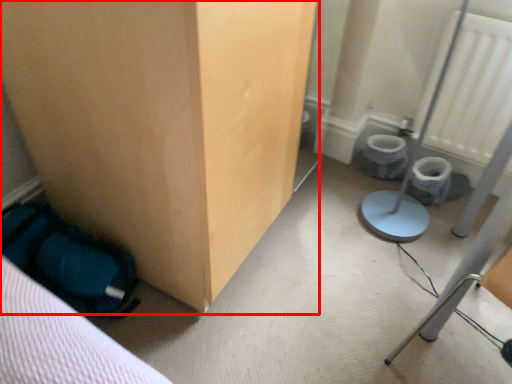
Question: In this image, where is furniture (annotated by the red box) located relative to radiator?

Choices:
 (A) right
 (B) left

Answer: (B)